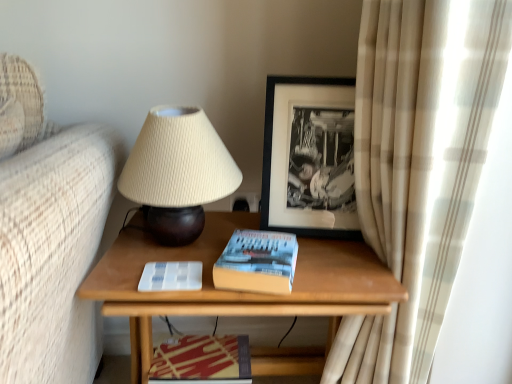
Question: Looking at the image, does beige ribbed fabric lampshade at upper center seem bigger or smaller compared to red glossy magazine at lower center?

Choices:
 (A) big
 (B) small

Answer: (A)

Question: From the image's perspective, is beige ribbed fabric lampshade at upper center located above or below red glossy magazine at lower center?

Choices:
 (A) above
 (B) below

Answer: (A)

Question: Which of these objects is positioned closest to the wooden table at center?

Choices:
 (A) black matte picture frame at upper center
 (B) beige plaid curtain at right
 (C) red glossy magazine at lower center
 (D) hardcover book at center
 (E) beige ribbed fabric lampshade at upper center

Answer: (D)

Question: Which object is the closest to the beige plaid curtain at right?

Choices:
 (A) red glossy magazine at lower center
 (B) beige ribbed fabric lampshade at upper center
 (C) wooden table at center
 (D) black matte picture frame at upper center
 (E) hardcover book at center

Answer: (D)